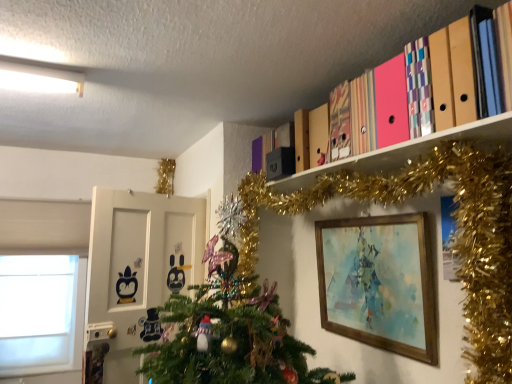
Question: Can you confirm if green matte christmas tree at upper right is thinner than matte cardboard folders at upper right?

Choices:
 (A) yes
 (B) no

Answer: (B)

Question: Is green matte christmas tree at upper right outside of matte cardboard folders at upper right?

Choices:
 (A) no
 (B) yes

Answer: (B)

Question: Are green matte christmas tree at upper right and matte cardboard folders at upper right located far from each other?

Choices:
 (A) no
 (B) yes

Answer: (A)

Question: From a real-world perspective, does green matte christmas tree at upper right stand above matte cardboard folders at upper right?

Choices:
 (A) yes
 (B) no

Answer: (B)

Question: Is green matte christmas tree at upper right oriented towards matte cardboard folders at upper right?

Choices:
 (A) yes
 (B) no

Answer: (A)

Question: Does green matte christmas tree at upper right lie in front of matte cardboard folders at upper right?

Choices:
 (A) no
 (B) yes

Answer: (B)

Question: Is green matte christmas tree at upper right looking in the opposite direction of white matte window at left?

Choices:
 (A) no
 (B) yes

Answer: (A)

Question: From a real-world perspective, is green matte christmas tree at upper right under white matte window at left?

Choices:
 (A) no
 (B) yes

Answer: (A)

Question: Is green matte christmas tree at upper right behind white matte window at left?

Choices:
 (A) no
 (B) yes

Answer: (A)

Question: Considering the relative sizes of green matte christmas tree at upper right and white matte window at left in the image provided, is green matte christmas tree at upper right bigger than white matte window at left?

Choices:
 (A) yes
 (B) no

Answer: (A)

Question: Would you say green matte christmas tree at upper right is outside white matte window at left?

Choices:
 (A) no
 (B) yes

Answer: (B)

Question: Is white matte window at left located within green matte christmas tree at upper right?

Choices:
 (A) no
 (B) yes

Answer: (A)

Question: From the image's perspective, does wooden picture frame at lower right appear lower than green matte christmas tree at upper right?

Choices:
 (A) no
 (B) yes

Answer: (B)